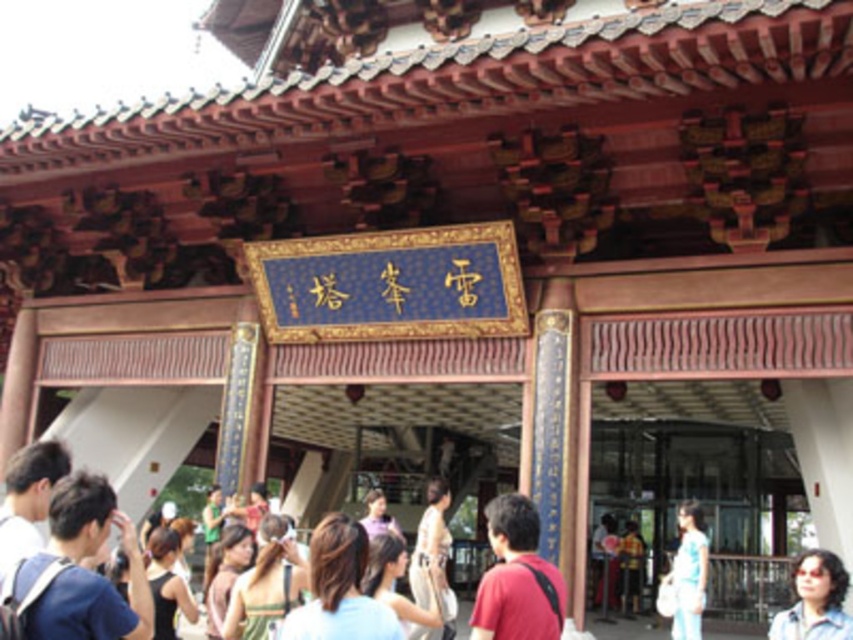
Does light blue denim jeans at lower right appear on the left side of silky white dress at center?

Incorrect, light blue denim jeans at lower right is not on the left side of silky white dress at center.

Consider the image. Is light blue denim jeans at lower right thinner than silky white dress at center?

No, light blue denim jeans at lower right is not thinner than silky white dress at center.

At what (x,y) coordinates should I click in order to perform the action: click on light blue denim jeans at lower right. Please return your answer as a coordinate pair (x, y). The width and height of the screenshot is (853, 640). Looking at the image, I should click on (688, 572).

This screenshot has width=853, height=640. What are the coordinates of `light blue fabric at center` in the screenshot? It's located at (339, 589).

Is point (357, 538) in front of point (410, 560)?

Yes, point (357, 538) is in front of point (410, 560).

Which is behind, point (375, 628) or point (428, 545)?

The point (428, 545) is behind.

Find the location of `light blue fabric at center`. light blue fabric at center is located at coordinates (339, 589).

Which of these two, red shirt at center or light blue denim jeans at lower right, stands shorter?

light blue denim jeans at lower right is shorter.

Is point (532, 531) in front of point (688, 605)?

Yes.

You are a GUI agent. You are given a task and a screenshot of the screen. Output one action in this format:
    pyautogui.click(x=<x>, y=<y>)
    Task: Click on the red shirt at center
    This screenshot has height=640, width=853.
    Given the screenshot: What is the action you would take?
    pyautogui.click(x=515, y=577)